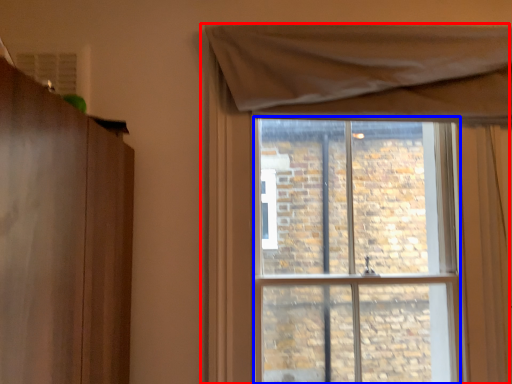
Question: Which of the following is the farthest to the observer, window (highlighted by a red box) or window screen (highlighted by a blue box)?

Choices:
 (A) window
 (B) window screen

Answer: (B)